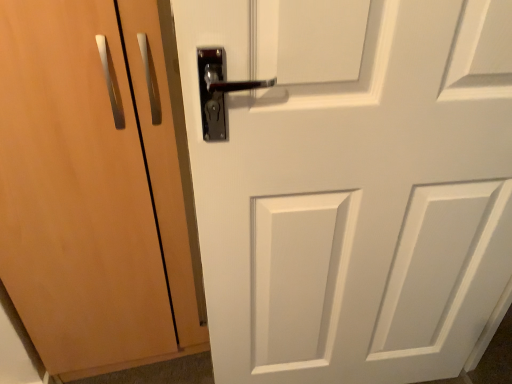
Question: Does white matte door at center, the 2th door positioned from the left, come in front of matte wood door at center, the 2th door positioned from the right?

Choices:
 (A) yes
 (B) no

Answer: (A)

Question: From the image's perspective, does white matte door at center, the 2th door positioned from the left, appear higher than matte wood door at center, arranged as the 1th door when viewed from the left?

Choices:
 (A) yes
 (B) no

Answer: (B)

Question: Can you confirm if white matte door at center, the first door from the right, is thinner than matte wood door at center, arranged as the 1th door when viewed from the left?

Choices:
 (A) no
 (B) yes

Answer: (B)

Question: Is white matte door at center, the 2th door positioned from the left, taller than matte wood door at center, the 2th door positioned from the right?

Choices:
 (A) yes
 (B) no

Answer: (A)

Question: Considering the relative positions of white matte door at center, the 2th door positioned from the left, and matte wood door at center, the 2th door positioned from the right, in the image provided, is white matte door at center, the 2th door positioned from the left, to the left of matte wood door at center, the 2th door positioned from the right, from the viewer's perspective?

Choices:
 (A) yes
 (B) no

Answer: (B)

Question: Can you confirm if white matte door at center, the 2th door positioned from the left, is bigger than matte wood door at center, the 2th door positioned from the right?

Choices:
 (A) yes
 (B) no

Answer: (B)

Question: Is white matte door at center, the first door from the right, located within matte wood door at center, the 2th door positioned from the right?

Choices:
 (A) yes
 (B) no

Answer: (B)

Question: Is matte wood door at center, arranged as the 1th door when viewed from the left, far away from white matte door at center, the 2th door positioned from the left?

Choices:
 (A) no
 (B) yes

Answer: (A)

Question: Can you confirm if matte wood door at center, the 2th door positioned from the right, is shorter than white matte door at center, the 2th door positioned from the left?

Choices:
 (A) yes
 (B) no

Answer: (A)

Question: From a real-world perspective, is matte wood door at center, arranged as the 1th door when viewed from the left, positioned under white matte door at center, the 2th door positioned from the left, based on gravity?

Choices:
 (A) no
 (B) yes

Answer: (B)

Question: Considering the relative positions of matte wood door at center, arranged as the 1th door when viewed from the left, and white matte door at center, the 2th door positioned from the left, in the image provided, is matte wood door at center, arranged as the 1th door when viewed from the left, in front of white matte door at center, the 2th door positioned from the left,?

Choices:
 (A) yes
 (B) no

Answer: (B)

Question: Can you confirm if matte wood door at center, arranged as the 1th door when viewed from the left, is bigger than white matte door at center, the first door from the right?

Choices:
 (A) no
 (B) yes

Answer: (B)

Question: Considering their positions, is matte wood door at center, arranged as the 1th door when viewed from the left, located in front of or behind white matte door at center, the 2th door positioned from the left?

Choices:
 (A) front
 (B) behind

Answer: (B)